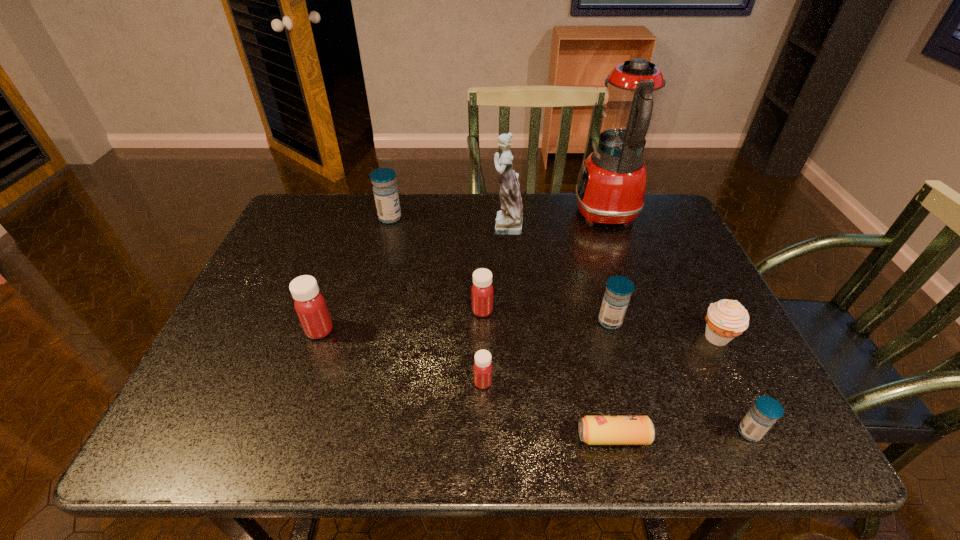
The height and width of the screenshot is (540, 960). What are the coordinates of `red medicine that stands as the third closest to the beer can` in the screenshot? It's located at (310, 305).

The width and height of the screenshot is (960, 540). Find the location of `free spot that satisfies the following two spatial constraints: 1. on the front-facing side of the smallest blue medicine; 2. on the left side of the second tallest object`. free spot that satisfies the following two spatial constraints: 1. on the front-facing side of the smallest blue medicine; 2. on the left side of the second tallest object is located at coordinates (518, 432).

Find the location of `vacant area that satisfies the following two spatial constraints: 1. on the front-facing side of the second tallest object; 2. on the left side of the shortest object`. vacant area that satisfies the following two spatial constraints: 1. on the front-facing side of the second tallest object; 2. on the left side of the shortest object is located at coordinates (518, 437).

Find the location of a particular element. The width and height of the screenshot is (960, 540). vacant region that satisfies the following two spatial constraints: 1. on the controls of the tallest object; 2. on the back side of the muffin is located at coordinates (651, 337).

Image resolution: width=960 pixels, height=540 pixels. I want to click on free space that satisfies the following two spatial constraints: 1. on the front side of the muffin; 2. on the left side of the second blue medicine from left to right, so click(614, 337).

Where is `free space that satisfies the following two spatial constraints: 1. on the front side of the nearest red medicine; 2. on the right side of the ninth object from right to left`? free space that satisfies the following two spatial constraints: 1. on the front side of the nearest red medicine; 2. on the right side of the ninth object from right to left is located at coordinates (348, 382).